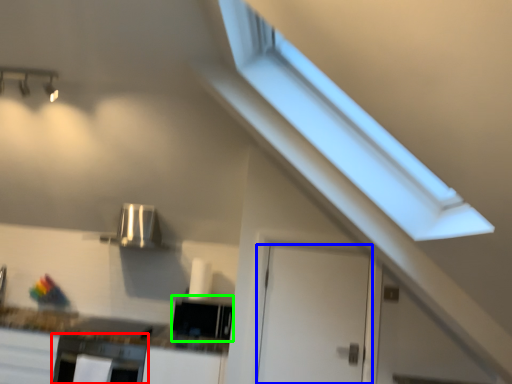
Question: Estimate the real-world distances between objects in this image. Which object is farther from oven (highlighted by a red box), door (highlighted by a blue box) or appliance (highlighted by a green box)?

Choices:
 (A) door
 (B) appliance

Answer: (A)